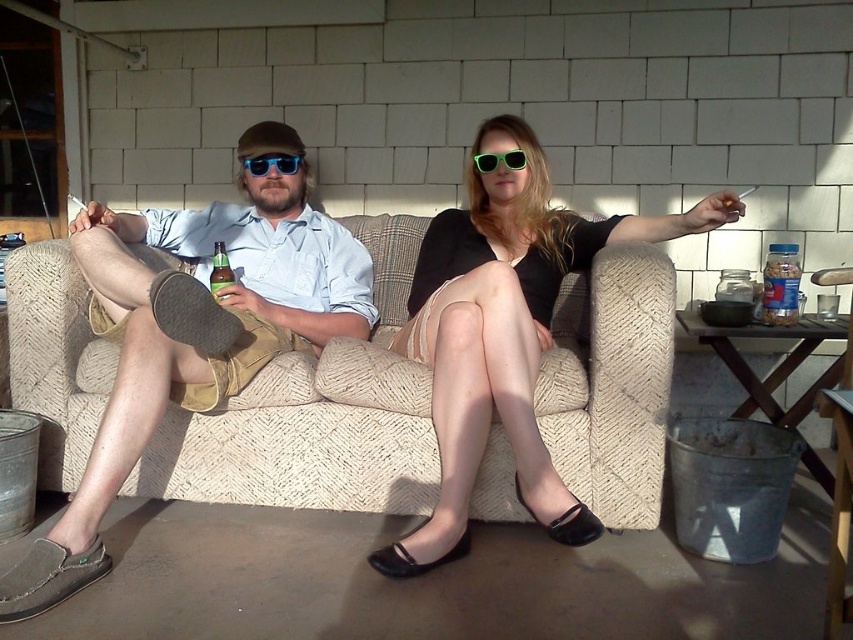
You are standing 2 meters away from the couch where the man and woman are sitting. If you want to place a small table exactly at point (775, 314), will it be within your reach?

The distance of point (775, 314) from viewer is 2.01 meters, so placing the table at that point would be just out of reach since you are standing 2 meters away.

From the picture: You are a photographer setting up a shoot in the scene described. You need to place a small prop between the matte black dress at center and the clear glass jar at right. Based on their positions, where should you place the prop to ensure it is between them?

The matte black dress at center is in front of the clear glass jar at right, so placing the prop between them would require positioning it in front of the clear glass jar at right but behind the matte black dress at center.

You are a photographer setting up a shoot in this outdoor scene. You need to ensure that the matte black dress at center and the green glass bottle at center are both visible in the frame. Given their relative heights, which object should you adjust to avoid being obscured by the other?

Since the matte black dress at center is taller than the green glass bottle at center, you should adjust the green glass bottle at center to ensure it isn